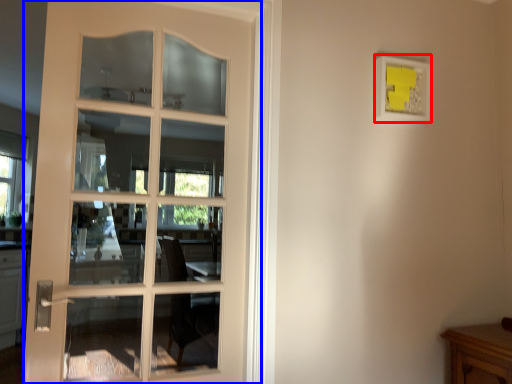
Question: Which point is further to the camera, picture frame (highlighted by a red box) or door (highlighted by a blue box)?

Choices:
 (A) picture frame
 (B) door

Answer: (A)